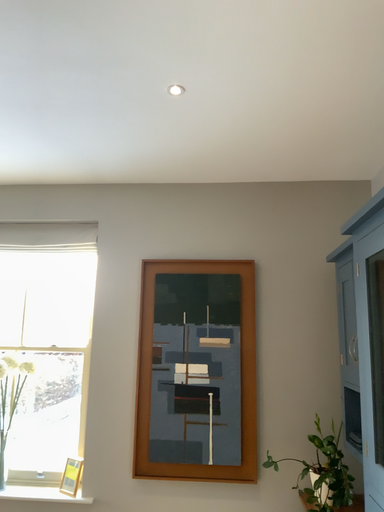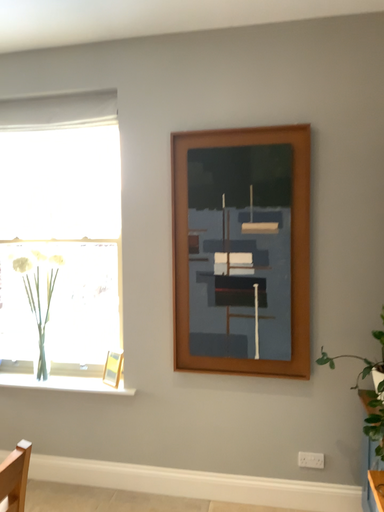
Question: How did the camera likely rotate when shooting the video?

Choices:
 (A) rotated left
 (B) rotated right

Answer: (A)